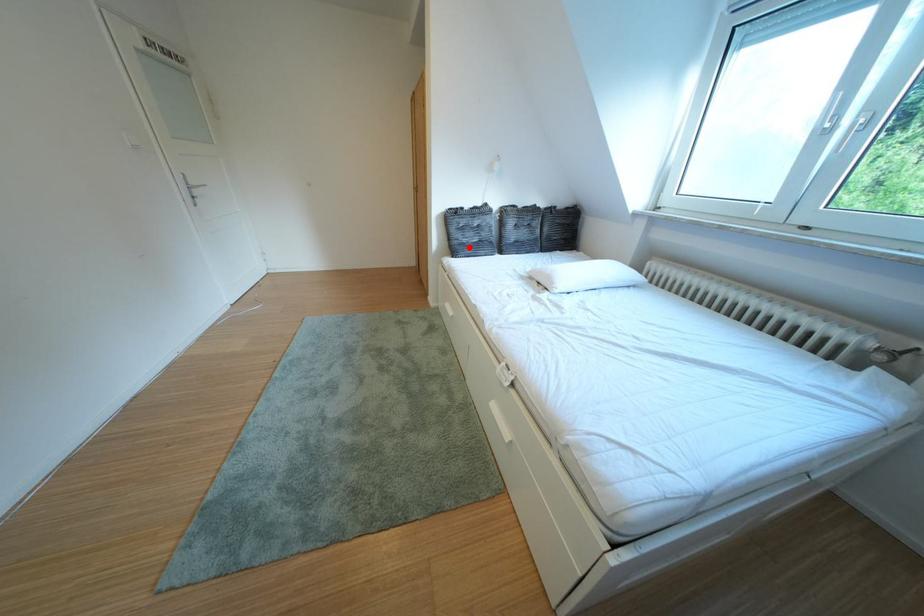
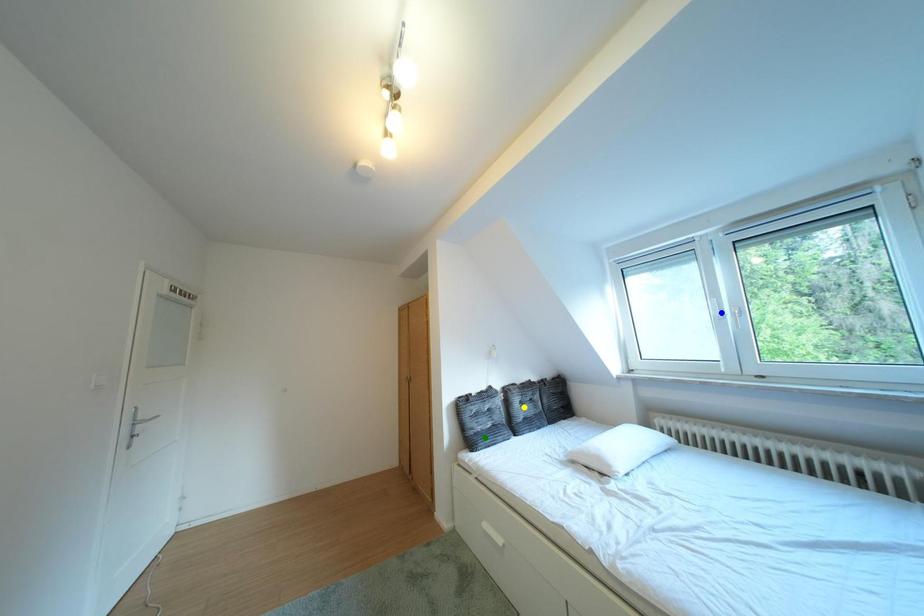
Question: I am providing you with two images of the same scene from different viewpoints. A red point is marked on the first image. You are given multiple points on the second image. Which mark in image 2 goes with the point in image 1?

Choices:
 (A) blue point
 (B) green point
 (C) yellow point

Answer: (B)